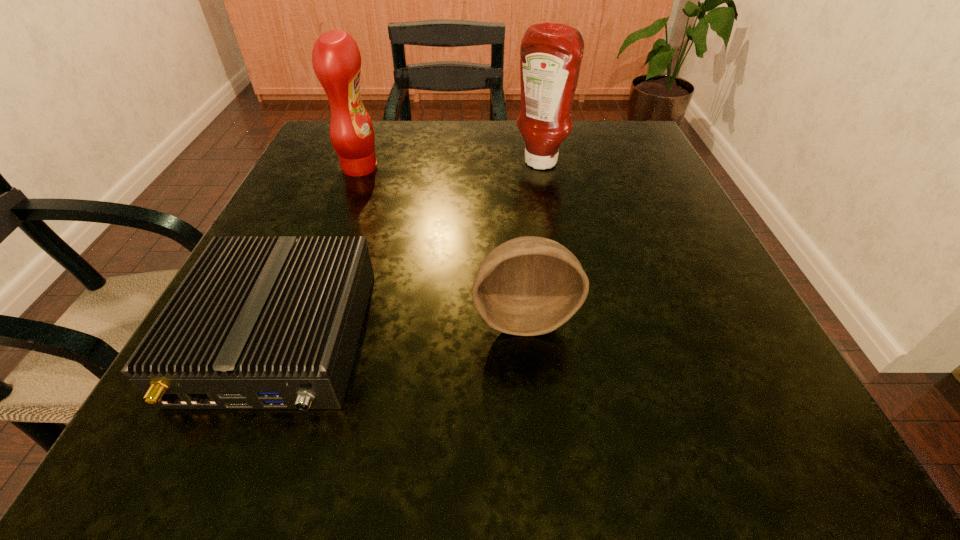
Find the location of a particular element. vacant space that satisfies the following two spatial constraints: 1. on the label side of the left condiment; 2. on the right side of the third tallest object is located at coordinates (302, 316).

This screenshot has height=540, width=960. Find the location of `vacant space that satisfies the following two spatial constraints: 1. on the label side of the left condiment; 2. on the back panel of the shortest object`. vacant space that satisfies the following two spatial constraints: 1. on the label side of the left condiment; 2. on the back panel of the shortest object is located at coordinates (295, 337).

This screenshot has width=960, height=540. Identify the location of vacant region that satisfies the following two spatial constraints: 1. on the back side of the bowl; 2. on the label side of the left condiment. (510, 167).